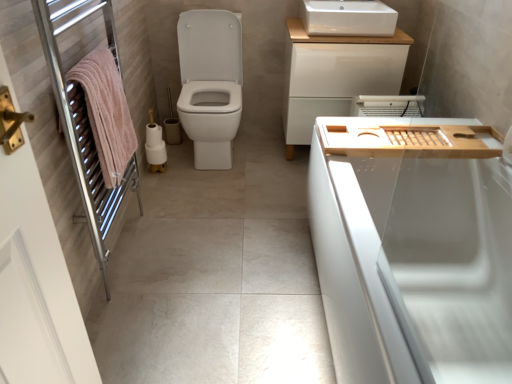
Find the location of `free spot above pink soft towel at left (from a real-world perspective)`. free spot above pink soft towel at left (from a real-world perspective) is located at coordinates (89, 58).